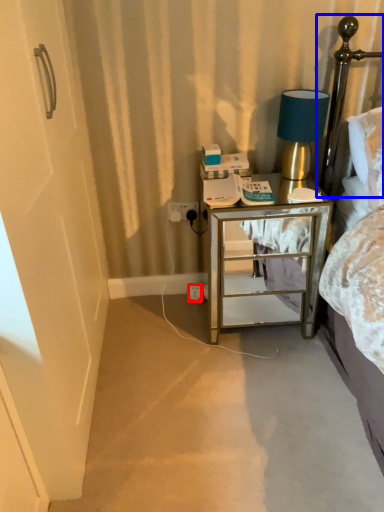
Question: Which object appears closest to the camera in this image, electric outlet (highlighted by a red box) or headboard (highlighted by a blue box)?

Choices:
 (A) electric outlet
 (B) headboard

Answer: (B)